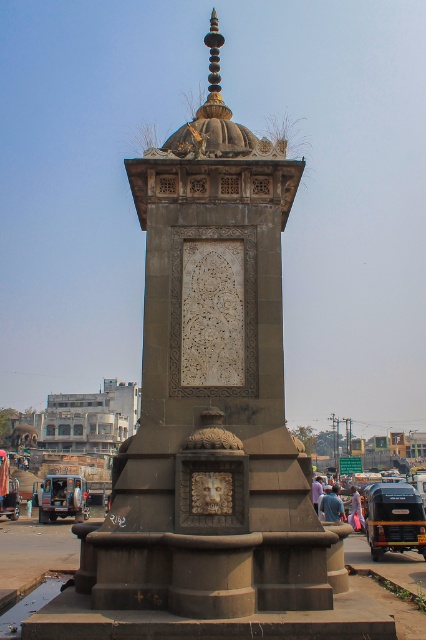
Question: Does blue metallic van at lower left appear on the right side of metallic car at center?

Choices:
 (A) yes
 (B) no

Answer: (A)

Question: Can you confirm if dark gray stone monument at center is positioned above metallic blue truck at lower right?

Choices:
 (A) yes
 (B) no

Answer: (A)

Question: Among these objects, which one is farthest from the camera?

Choices:
 (A) blue metallic van at lower left
 (B) dark gray stone monument at center
 (C) metallic blue truck at lower right

Answer: (A)

Question: Is dark gray stone monument at center closer to the viewer compared to metallic blue truck at lower right?

Choices:
 (A) no
 (B) yes

Answer: (B)

Question: Estimate the real-world distances between objects in this image. Which object is farther from the metallic car at center?

Choices:
 (A) metallic blue truck at lower right
 (B) dark gray stone monument at center

Answer: (B)

Question: Estimate the real-world distances between objects in this image. Which object is closer to the metallic blue truck at lower right?

Choices:
 (A) dark gray stone monument at center
 (B) blue metallic van at lower left

Answer: (A)